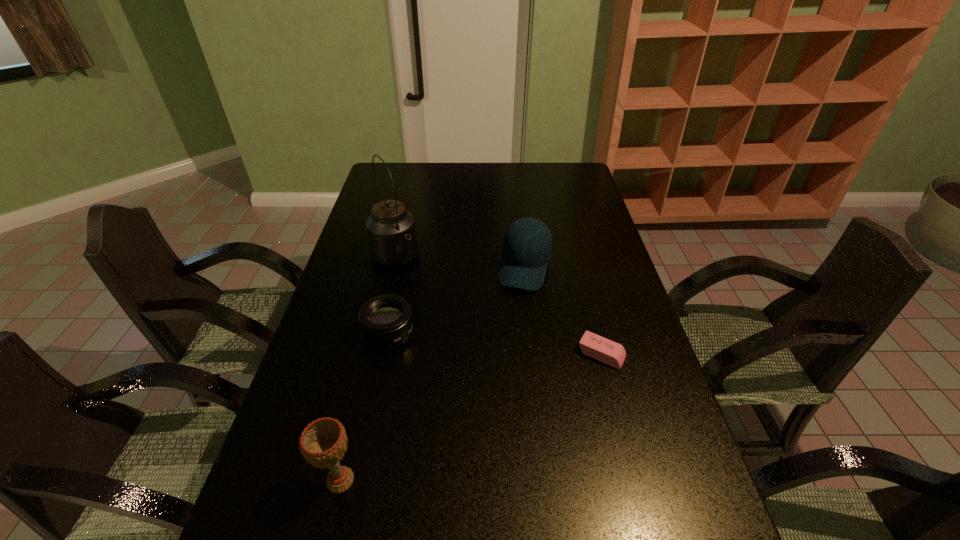
Image resolution: width=960 pixels, height=540 pixels. What are the coordinates of `chalice` in the screenshot? It's located at (323, 442).

Locate an element on the screen. The height and width of the screenshot is (540, 960). the nearest object is located at coordinates (323, 442).

Where is `the rightmost object`? The width and height of the screenshot is (960, 540). the rightmost object is located at coordinates pyautogui.click(x=597, y=347).

Where is `the shortest object`? This screenshot has width=960, height=540. the shortest object is located at coordinates (597, 347).

You are a GUI agent. You are given a task and a screenshot of the screen. Output one action in this format:
    pyautogui.click(x=<x>, y=<y>)
    Task: Click on the tallest object
    The height and width of the screenshot is (540, 960).
    Given the screenshot: What is the action you would take?
    pyautogui.click(x=392, y=238)

Find the location of a particular element. This screenshot has height=540, width=960. the second shortest object is located at coordinates (386, 322).

What are the coordinates of `the fourth object from left to right` in the screenshot? It's located at (527, 245).

I want to click on the third shortest object, so click(x=527, y=245).

Identify the location of vacant region located on the back of the second tallest object. (358, 404).

Identify the location of free location located on the left of the eraser. This screenshot has height=540, width=960. (449, 354).